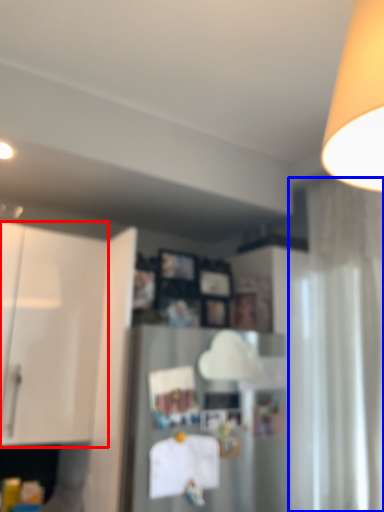
Question: Among these objects, which one is nearest to the camera, cabinetry (highlighted by a red box) or curtain (highlighted by a blue box)?

Choices:
 (A) cabinetry
 (B) curtain

Answer: (B)